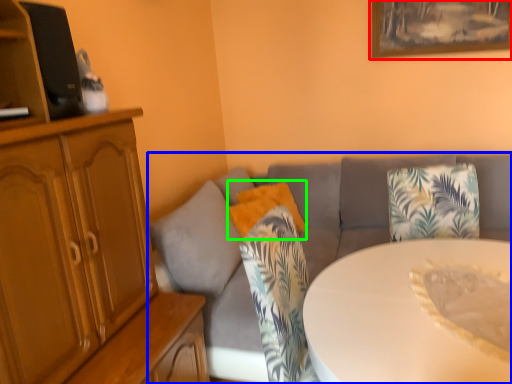
Question: Considering the real-world distances, which object is farthest from picture frame (highlighted by a red box)? studio couch (highlighted by a blue box) or pillow (highlighted by a green box)?

Choices:
 (A) studio couch
 (B) pillow

Answer: (B)